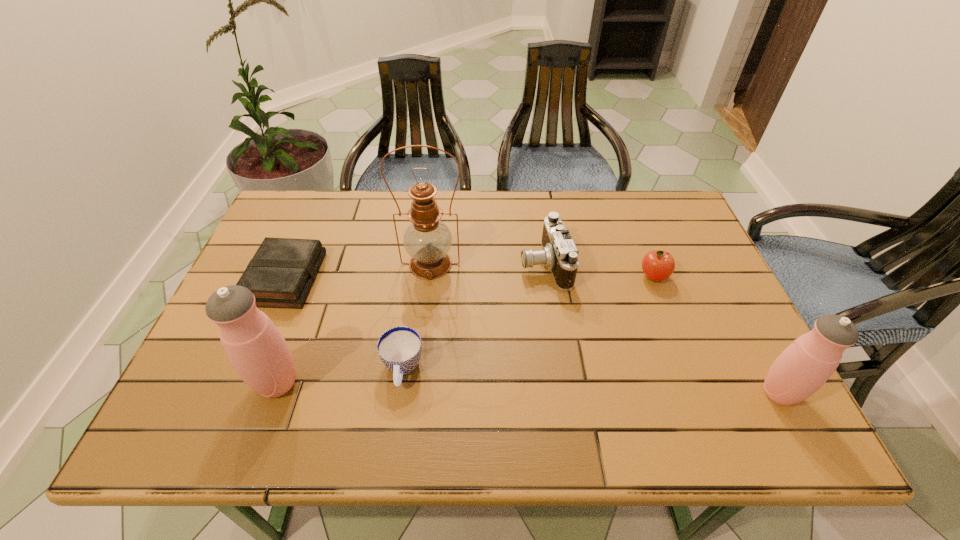
Locate an element on the screen. object that is the third closest to the sixth shortest object is located at coordinates (427, 240).

Where is `vacant area that satisfies the following two spatial constraints: 1. at the lens of the third object from right to left; 2. on the side of the cup with the handle`? The image size is (960, 540). vacant area that satisfies the following two spatial constraints: 1. at the lens of the third object from right to left; 2. on the side of the cup with the handle is located at coordinates (560, 369).

Find the location of a particular element. Image resolution: width=960 pixels, height=540 pixels. blank area in the image that satisfies the following two spatial constraints: 1. on the front side of the right thermos bottle; 2. on the left side of the second tallest object is located at coordinates (275, 393).

The width and height of the screenshot is (960, 540). I want to click on vacant space that satisfies the following two spatial constraints: 1. on the back side of the sixth object from left to right; 2. on the left side of the taller thermos bottle, so click(316, 276).

Find the location of `vacant space that satisfies the following two spatial constraints: 1. at the lens of the apple; 2. on the right side of the camera`. vacant space that satisfies the following two spatial constraints: 1. at the lens of the apple; 2. on the right side of the camera is located at coordinates (546, 276).